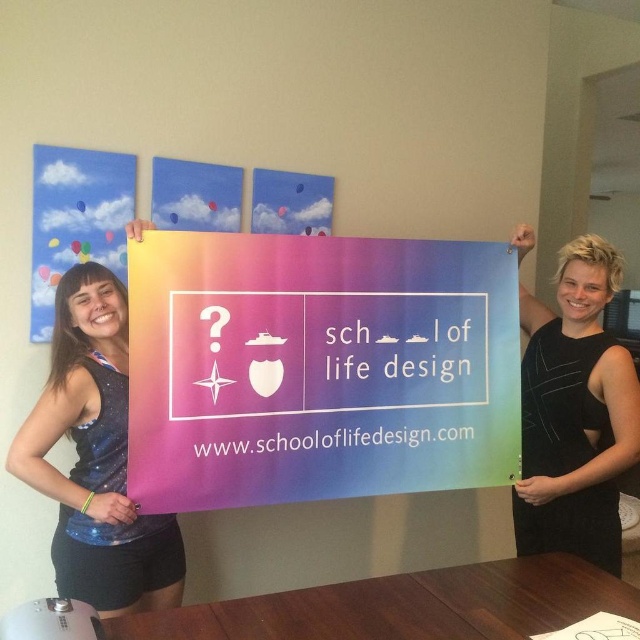
Question: Which point appears farthest from the camera in this image?

Choices:
 (A) (67, 316)
 (B) (387, 486)

Answer: (B)

Question: Is rainbow gradient poster at center to the left of glossy fabric tank top at left from the viewer's perspective?

Choices:
 (A) yes
 (B) no

Answer: (B)

Question: From the image, what is the correct spatial relationship of rainbow gradient poster at center in relation to glossy fabric tank top at left?

Choices:
 (A) right
 (B) left

Answer: (A)

Question: Which point is farther from the camera taking this photo?

Choices:
 (A) (538, 342)
 (B) (115, 593)
 (C) (301, 308)

Answer: (A)

Question: Which object appears farthest from the camera in this image?

Choices:
 (A) rainbow gradient poster at center
 (B) glossy fabric tank top at left
 (C) black matte dress at right

Answer: (C)

Question: Is glossy fabric tank top at left positioned in front of black matte dress at right?

Choices:
 (A) yes
 (B) no

Answer: (A)